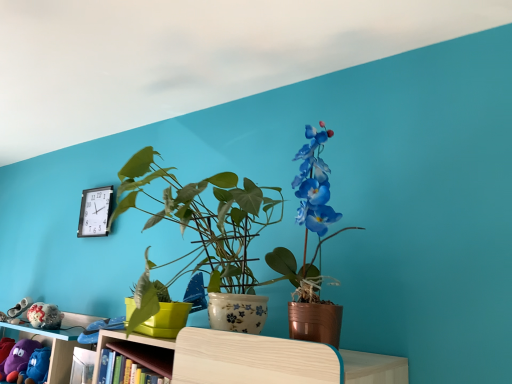
Question: Is black plastic clock at upper left positioned before purple fabric plush at lower left?

Choices:
 (A) no
 (B) yes

Answer: (A)

Question: Does black plastic clock at upper left appear on the left side of purple fabric plush at lower left?

Choices:
 (A) yes
 (B) no

Answer: (B)

Question: Could you tell me if black plastic clock at upper left is facing purple fabric plush at lower left?

Choices:
 (A) yes
 (B) no

Answer: (B)

Question: Considering the relative sizes of black plastic clock at upper left and purple fabric plush at lower left in the image provided, is black plastic clock at upper left wider than purple fabric plush at lower left?

Choices:
 (A) yes
 (B) no

Answer: (B)

Question: Is black plastic clock at upper left to the right of purple fabric plush at lower left from the viewer's perspective?

Choices:
 (A) yes
 (B) no

Answer: (A)

Question: Can you confirm if black plastic clock at upper left is shorter than purple fabric plush at lower left?

Choices:
 (A) yes
 (B) no

Answer: (B)

Question: Does purple fabric plush at lower left appear on the left side of black plastic clock at upper left?

Choices:
 (A) yes
 (B) no

Answer: (A)

Question: Can you confirm if purple fabric plush at lower left is shorter than black plastic clock at upper left?

Choices:
 (A) no
 (B) yes

Answer: (B)

Question: From the image's perspective, is purple fabric plush at lower left below black plastic clock at upper left?

Choices:
 (A) yes
 (B) no

Answer: (A)

Question: Is purple fabric plush at lower left at the right side of black plastic clock at upper left?

Choices:
 (A) yes
 (B) no

Answer: (B)

Question: Is purple fabric plush at lower left located outside black plastic clock at upper left?

Choices:
 (A) no
 (B) yes

Answer: (B)

Question: Is purple fabric plush at lower left further to camera compared to black plastic clock at upper left?

Choices:
 (A) yes
 (B) no

Answer: (B)

Question: Considering the relative sizes of metallic copper pot at center and black plastic clock at upper left in the image provided, is metallic copper pot at center bigger than black plastic clock at upper left?

Choices:
 (A) no
 (B) yes

Answer: (B)